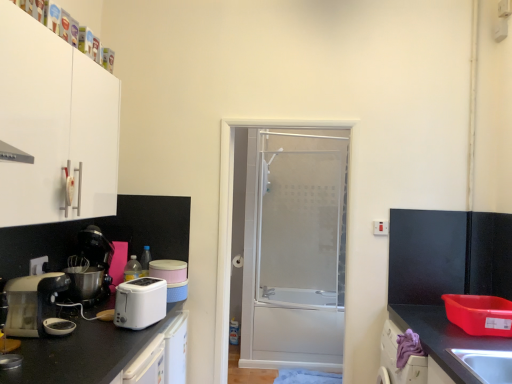
Image resolution: width=512 pixels, height=384 pixels. What do you see at coordinates (90, 267) in the screenshot?
I see `black plastic coffee machine at left` at bounding box center [90, 267].

What do you see at coordinates (140, 303) in the screenshot?
I see `white plastic toaster at lower left` at bounding box center [140, 303].

You are a GUI agent. You are given a task and a screenshot of the screen. Output one action in this format:
    pyautogui.click(x=<x>, y=<y>)
    Task: Click on the purple fabric at lower right
    This screenshot has height=384, width=512.
    Given the screenshot: What is the action you would take?
    pyautogui.click(x=396, y=360)

The height and width of the screenshot is (384, 512). What do you see at coordinates (32, 302) in the screenshot? I see `matte white toaster at left` at bounding box center [32, 302].

Locate an element on the screen. This screenshot has width=512, height=384. transparent glass shower door at center is located at coordinates (294, 249).

The image size is (512, 384). Find the location of `black plastic coffee machine at left`. black plastic coffee machine at left is located at coordinates (90, 267).

Is matte white toaster at left not within white plastic toaster at lower left?

Absolutely, matte white toaster at left is external to white plastic toaster at lower left.

Between matte white toaster at left and white plastic toaster at lower left, which one has smaller width?

white plastic toaster at lower left.

Is matte white toaster at left directly adjacent to white plastic toaster at lower left?

There is a gap between matte white toaster at left and white plastic toaster at lower left.

Can you confirm if matte white toaster at left is bigger than white plastic toaster at lower left?

Correct, matte white toaster at left is larger in size than white plastic toaster at lower left.

Can you confirm if black matte countertop at lower left, which is the second countertop in right-to-left order, is bigger than matte white toaster at left?

Yes, black matte countertop at lower left, which is the second countertop in right-to-left order, is bigger than matte white toaster at left.

Considering the positions of objects black matte countertop at lower left, which ranks as the 1th countertop in left-to-right order, and matte white toaster at left in the image provided, who is in front, black matte countertop at lower left, which ranks as the 1th countertop in left-to-right order, or matte white toaster at left?

black matte countertop at lower left, which ranks as the 1th countertop in left-to-right order, is closer to the camera.

Can you confirm if black matte countertop at lower left, which is the second countertop in right-to-left order, is taller than matte white toaster at left?

Indeed, black matte countertop at lower left, which is the second countertop in right-to-left order, has a greater height compared to matte white toaster at left.

From the image's perspective, starting from the matte white toaster at left, which countertop is the 1st one below? Please provide its 2D coordinates.

[(83, 353)]

Who is shorter, white matte cabinet at upper left or purple fabric at lower right?

purple fabric at lower right.

Consider the image. Is white matte cabinet at upper left further to the viewer compared to purple fabric at lower right?

No, the depth of white matte cabinet at upper left is less than that of purple fabric at lower right.

Considering the sizes of objects white matte cabinet at upper left and purple fabric at lower right in the image provided, who is thinner, white matte cabinet at upper left or purple fabric at lower right?

purple fabric at lower right is thinner.

Measure the distance from purple fabric at lower right to black plastic coffee machine at left.

The distance of purple fabric at lower right from black plastic coffee machine at left is 1.64 meters.

Consider the image. Is purple fabric at lower right oriented towards black plastic coffee machine at left?

Yes, purple fabric at lower right faces towards black plastic coffee machine at left.

Can you confirm if purple fabric at lower right is thinner than black plastic coffee machine at left?

Correct, the width of purple fabric at lower right is less than that of black plastic coffee machine at left.

Can you confirm if purple fabric at lower right is taller than black plastic coffee machine at left?

No.

Is matte white toaster at left not near white plastic electric outlet at lower left?

That's not correct — matte white toaster at left is a little close to white plastic electric outlet at lower left.

From the image's perspective, which one is positioned higher, matte white toaster at left or white plastic electric outlet at lower left?

white plastic electric outlet at lower left, from the image's perspective.

Could white plastic electric outlet at lower left be considered to be inside matte white toaster at left?

Definitely not — white plastic electric outlet at lower left is not inside matte white toaster at left.

Considering the relative positions of matte white toaster at left and white plastic electric outlet at lower left in the image provided, is matte white toaster at left to the left or to the right of white plastic electric outlet at lower left?

matte white toaster at left is positioned on white plastic electric outlet at lower left's right side.

Would you consider transparent glass shower door at center to be distant from white plastic electric outlet at lower left?

Yes, transparent glass shower door at center is far from white plastic electric outlet at lower left.

Can you confirm if transparent glass shower door at center is bigger than white plastic electric outlet at lower left?

Yes.

Does transparent glass shower door at center appear on the right side of white plastic electric outlet at lower left?

Correct, you'll find transparent glass shower door at center to the right of white plastic electric outlet at lower left.

Considering the relative sizes of white matte cabinet at upper left and white plastic toaster at lower left in the image provided, is white matte cabinet at upper left thinner than white plastic toaster at lower left?

No, white matte cabinet at upper left is not thinner than white plastic toaster at lower left.

I want to click on kitchen appliance that appears behind the white matte cabinet at upper left, so click(x=140, y=303).

From the image's perspective, is white matte cabinet at upper left on white plastic toaster at lower left?

Correct, white matte cabinet at upper left appears higher than white plastic toaster at lower left in the image.

From the picture: Which is further, (x=32, y=138) or (x=148, y=295)?

The point (x=148, y=295) is farther.

Where is `kitchen appliance below the matte white toaster at left (from the image's perspective)`? kitchen appliance below the matte white toaster at left (from the image's perspective) is located at coordinates click(x=140, y=303).

Find the location of a particular element. This screenshot has width=512, height=384. home appliance above the black matte countertop at lower left, which ranks as the 1th countertop in left-to-right order (from the image's perspective) is located at coordinates (32, 302).

Based on their spatial positions, is white plastic electric outlet at lower left or black plastic coffee machine at left further from white matte cabinet at upper left?

Based on the image, black plastic coffee machine at left appears to be further to white matte cabinet at upper left.

Estimate the real-world distances between objects in this image. Which object is further from black matte countertop at lower left, which ranks as the 1th countertop in left-to-right order, white plastic toaster at lower left or matte white toaster at left?

Among the two, matte white toaster at left is located further to black matte countertop at lower left, which ranks as the 1th countertop in left-to-right order.

Estimate the real-world distances between objects in this image. Which object is further from matte white toaster at left, black plastic coffee machine at left or black matte countertop at lower left, which ranks as the 1th countertop in left-to-right order?

The object further to matte white toaster at left is black plastic coffee machine at left.

From the image, which object appears to be nearer to transparent glass shower door at center, white matte cabinet at upper left or matte white toaster at left?

Among the two, white matte cabinet at upper left is located nearer to transparent glass shower door at center.

In the scene shown: From the image, which object appears to be farther from black matte countertop at lower left, which ranks as the 1th countertop in left-to-right order, matte white toaster at left or white matte cabinet at upper left?

Among the two, white matte cabinet at upper left is located further to black matte countertop at lower left, which ranks as the 1th countertop in left-to-right order.

Which object lies nearer to the anchor point black matte countertop at lower left, which ranks as the 1th countertop in left-to-right order, matte white toaster at left or black plastic coffee machine at left?

matte white toaster at left lies closer to black matte countertop at lower left, which ranks as the 1th countertop in left-to-right order, than the other object.

Looking at the image, which one is located closer to purple fabric at lower right, white plastic electric outlet at lower left or white matte cabinet at upper left?

white plastic electric outlet at lower left is positioned closer to the anchor purple fabric at lower right.

Estimate the real-world distances between objects in this image. Which object is closer to matte white toaster at left, purple fabric at lower right or black granite countertop at lower right, arranged as the 2th countertop when viewed from the left?

purple fabric at lower right.

Where is `screen door between white plastic electric outlet at lower left and black granite countertop at lower right, arranged as the 2th countertop when viewed from the left, in the horizontal direction`? screen door between white plastic electric outlet at lower left and black granite countertop at lower right, arranged as the 2th countertop when viewed from the left, in the horizontal direction is located at coordinates (294, 249).

This screenshot has height=384, width=512. Identify the location of home appliance between white plastic electric outlet at lower left and transparent glass shower door at center in the horizontal direction. (32, 302).

Locate an element on the screen. This screenshot has width=512, height=384. coffee machine between matte white toaster at left and black granite countertop at lower right, arranged as the first countertop when viewed from the right, in the horizontal direction is located at coordinates (90, 267).

The height and width of the screenshot is (384, 512). Identify the location of electric outlet between white matte cabinet at upper left and matte white toaster at left in the up-down direction. (37, 265).